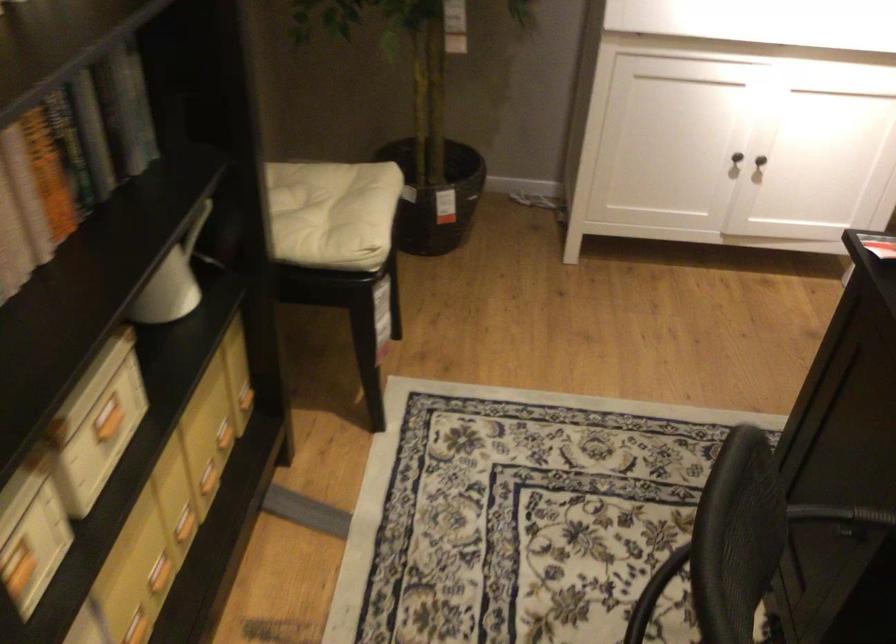
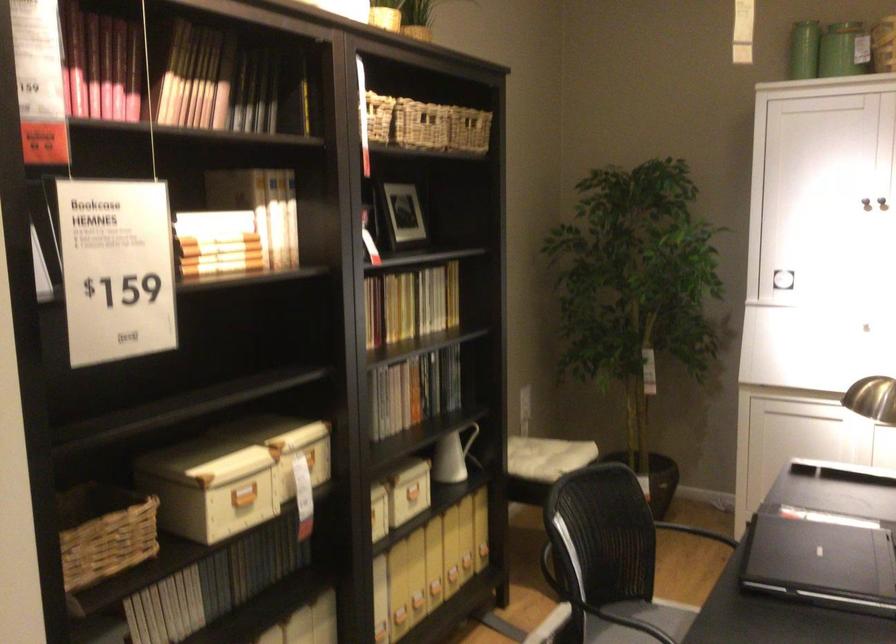
Find the pixel in the second image that matches pixel 209 230 in the first image.

(474, 444)